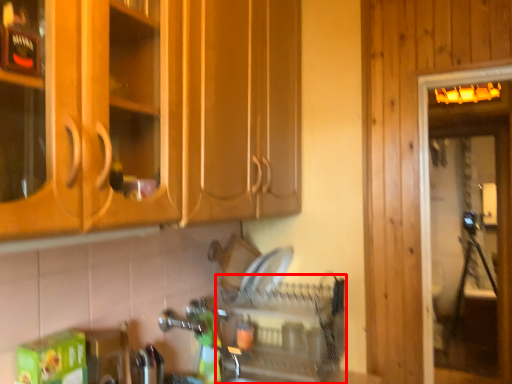
Question: Observing the image, what is the correct spatial positioning of dish washer (annotated by the red box) in reference to screen door?

Choices:
 (A) left
 (B) right

Answer: (A)